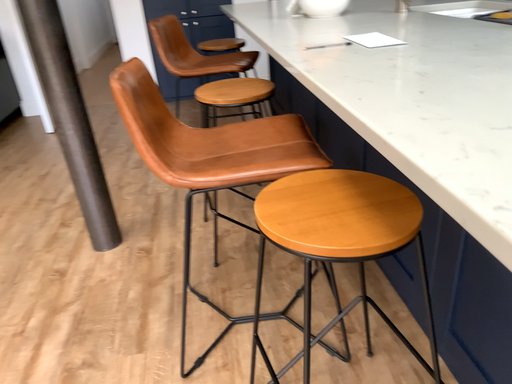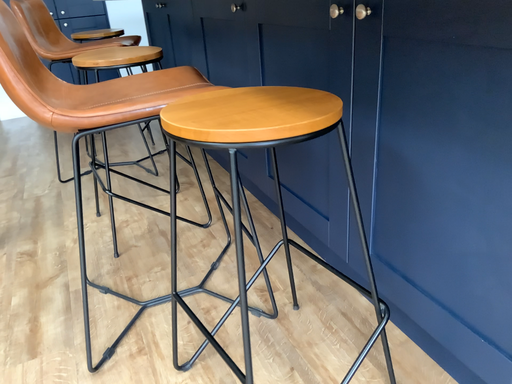
Question: How did the camera likely rotate when shooting the video?

Choices:
 (A) rotated left
 (B) rotated right

Answer: (B)